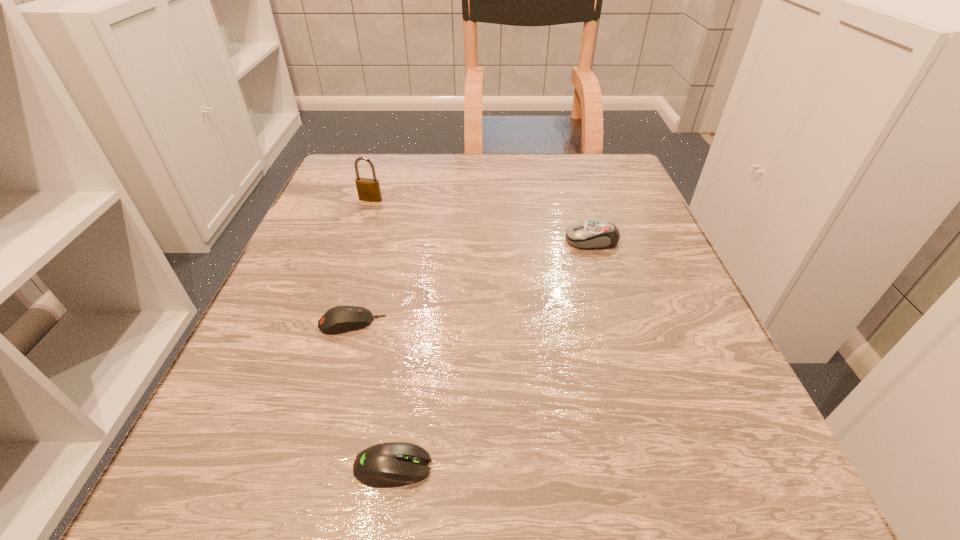
At what (x,y) coordinates should I click in order to perform the action: click on vacant space situated 0.360m on the wheel side of the rightmost object. Please return your answer as a coordinate pair (x, y). Looking at the image, I should click on (377, 240).

This screenshot has width=960, height=540. I want to click on vacant space located 0.120m on the wheel side of the rightmost object, so click(x=502, y=240).

Where is `vacant space located 0.270m on the right of the third farthest object`? The height and width of the screenshot is (540, 960). vacant space located 0.270m on the right of the third farthest object is located at coordinates (558, 323).

Identify the location of vacant space located 0.110m on the wheel side of the nearest object. (525, 467).

The height and width of the screenshot is (540, 960). I want to click on object situated at the far edge, so [x=368, y=189].

Image resolution: width=960 pixels, height=540 pixels. What are the coordinates of `object that is positioned at the near edge` in the screenshot? It's located at (393, 464).

Identify the location of padlock at the left edge. The height and width of the screenshot is (540, 960). (368, 189).

Where is `computer mouse positioned at the left edge`? The image size is (960, 540). computer mouse positioned at the left edge is located at coordinates (338, 319).

The height and width of the screenshot is (540, 960). Find the location of `object positioned at the right edge`. object positioned at the right edge is located at coordinates (595, 234).

In order to click on object located at the far left corner in this screenshot , I will do `click(368, 189)`.